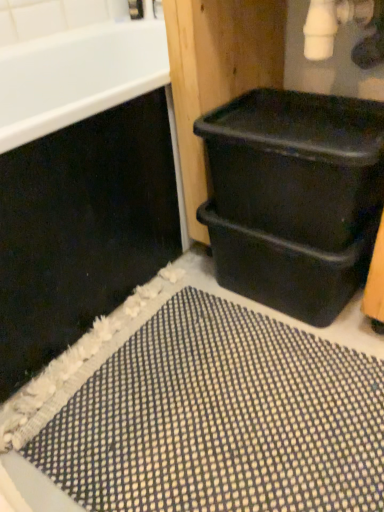
Question: From a real-world perspective, is black plastic bin at lower right physically above black plastic bin at right?

Choices:
 (A) no
 (B) yes

Answer: (A)

Question: Is the depth of black plastic bin at lower right less than that of black plastic bin at right?

Choices:
 (A) no
 (B) yes

Answer: (A)

Question: Is black plastic bin at lower right positioned behind black plastic bin at right?

Choices:
 (A) no
 (B) yes

Answer: (B)

Question: Would you say black plastic bin at lower right is outside black plastic bin at right?

Choices:
 (A) no
 (B) yes

Answer: (B)

Question: From a real-world perspective, is black plastic bin at lower right physically below black plastic bin at right?

Choices:
 (A) no
 (B) yes

Answer: (B)

Question: From the image's perspective, is black plastic bin at lower right beneath black plastic bin at right?

Choices:
 (A) yes
 (B) no

Answer: (A)

Question: Considering the relative positions of black plastic bin at lower right and black plastic tub at right in the image provided, is black plastic bin at lower right to the right of black plastic tub at right from the viewer's perspective?

Choices:
 (A) yes
 (B) no

Answer: (A)

Question: From the image's perspective, is black plastic bin at lower right over black plastic tub at right?

Choices:
 (A) no
 (B) yes

Answer: (A)

Question: Can you confirm if black plastic bin at lower right is wider than black plastic tub at right?

Choices:
 (A) no
 (B) yes

Answer: (A)

Question: Is black plastic tub at right located within black plastic bin at lower right?

Choices:
 (A) yes
 (B) no

Answer: (B)

Question: Would you say black plastic bin at lower right is outside black plastic tub at right?

Choices:
 (A) yes
 (B) no

Answer: (A)

Question: From a real-world perspective, is black plastic bin at lower right below black plastic tub at right?

Choices:
 (A) no
 (B) yes

Answer: (B)

Question: Is black plastic tub at right facing towards black plastic bin at lower right?

Choices:
 (A) yes
 (B) no

Answer: (B)